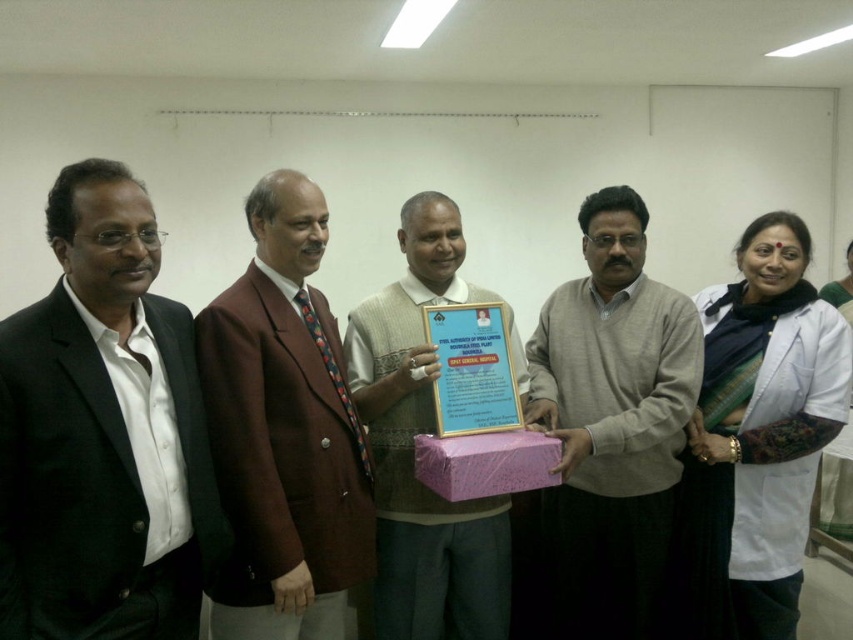
Question: Is brown woolen blazer at center to the left of matte brown vest at center from the viewer's perspective?

Choices:
 (A) no
 (B) yes

Answer: (B)

Question: Which of the following is the closest to the observer?

Choices:
 (A) (651, 627)
 (B) (419, 513)
 (C) (514, 442)
 (D) (19, 408)

Answer: (D)

Question: Is the position of black matte suit at left less distant than that of light gray sweater at center?

Choices:
 (A) yes
 (B) no

Answer: (A)

Question: Among these points, which one is farthest from the camera?

Choices:
 (A) (383, 396)
 (B) (236, 342)
 (C) (631, 618)

Answer: (C)

Question: Can you confirm if brown woolen blazer at center is wider than matte brown vest at center?

Choices:
 (A) no
 (B) yes

Answer: (A)

Question: Which object appears farthest from the camera in this image?

Choices:
 (A) light gray sweater at center
 (B) matte brown vest at center

Answer: (B)